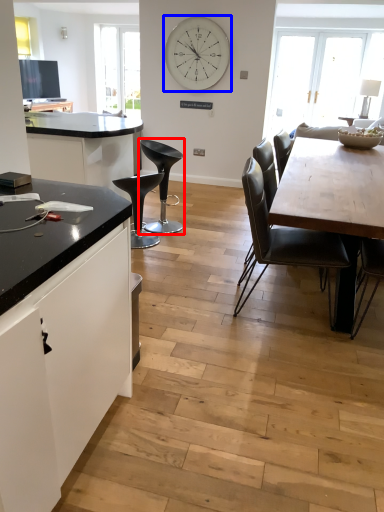
Question: Which object is further to the camera taking this photo, chair (highlighted by a red box) or clock (highlighted by a blue box)?

Choices:
 (A) chair
 (B) clock

Answer: (B)